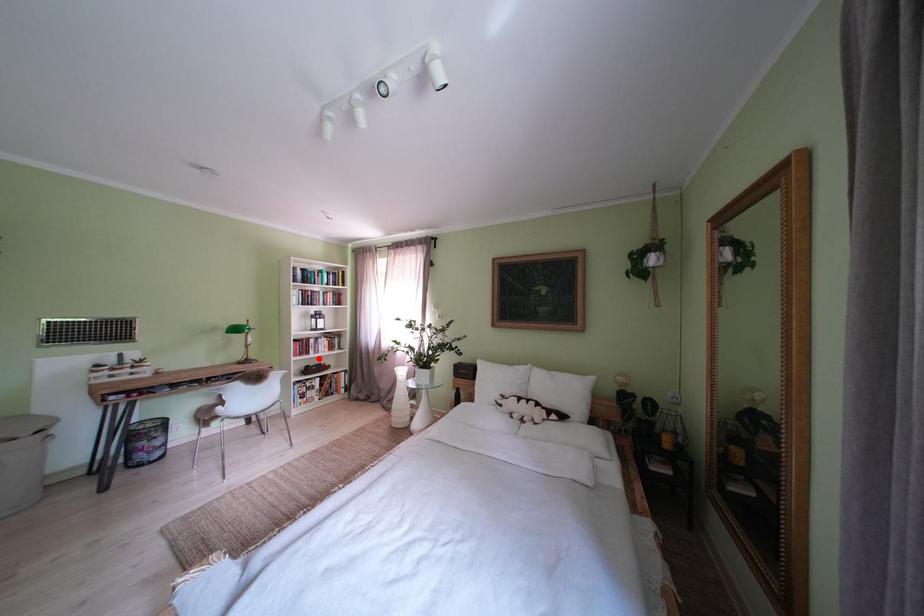
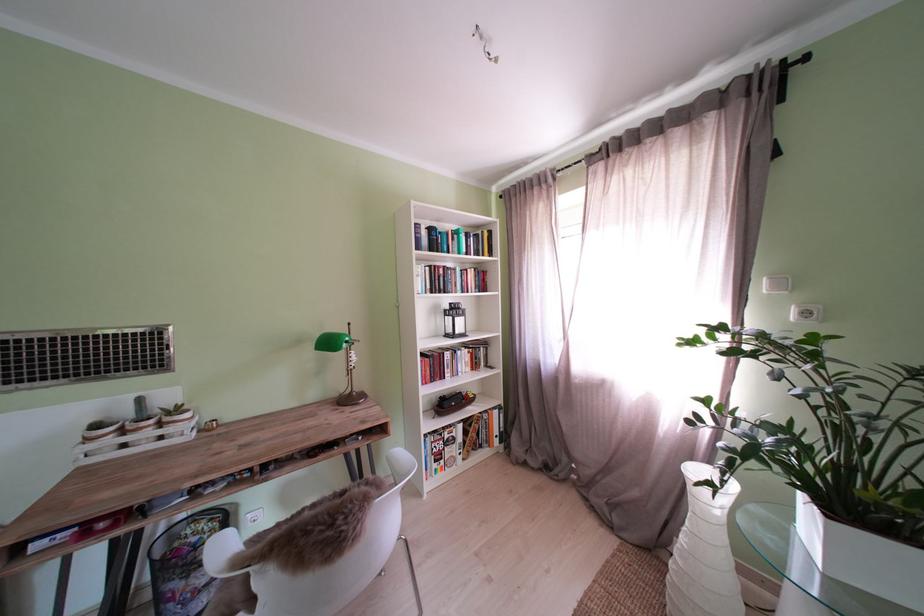
Find the pixel in the second image that matches the highlighted location in the first image.

(454, 382)